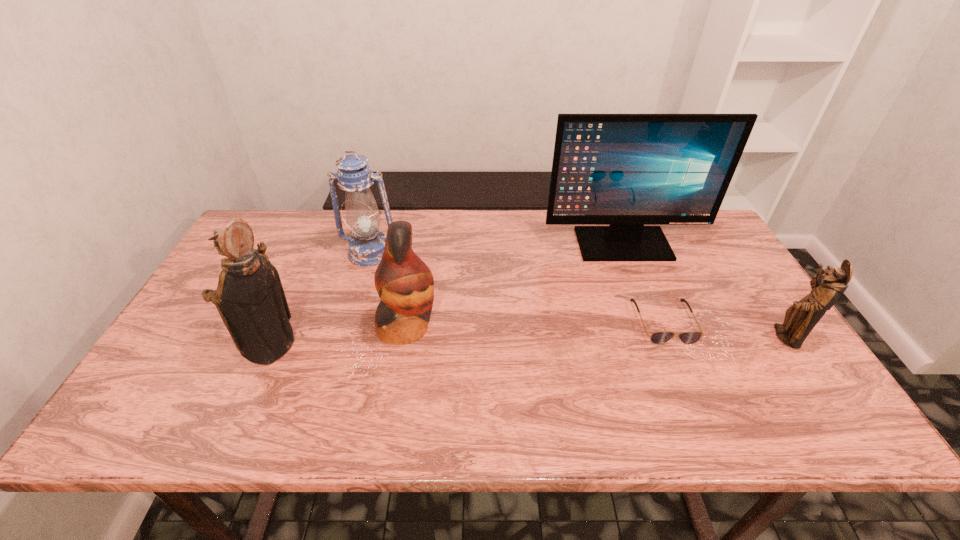
Locate an element on the screen. free space that satisfies the following two spatial constraints: 1. on the screen side of the monitor; 2. on the front-facing side of the left figurine is located at coordinates (662, 346).

The height and width of the screenshot is (540, 960). I want to click on free space that satisfies the following two spatial constraints: 1. on the front-facing side of the lantern; 2. on the front-facing side of the leftmost object, so click(x=343, y=346).